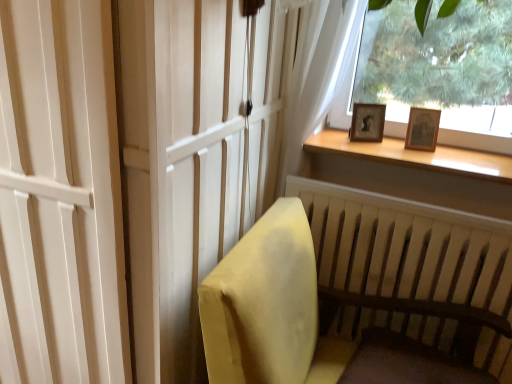
You are a GUI agent. You are given a task and a screenshot of the screen. Output one action in this format:
    pyautogui.click(x=<x>, y=<y>)
    Task: Click on the free location above wooden at upper right (from a real-world perspective)
    
    Given the screenshot: What is the action you would take?
    pyautogui.click(x=447, y=157)